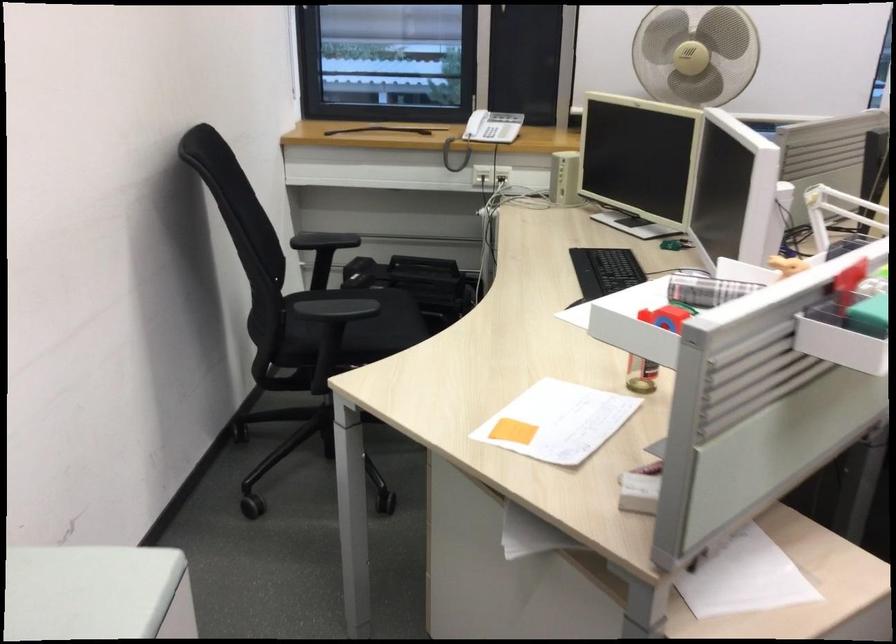
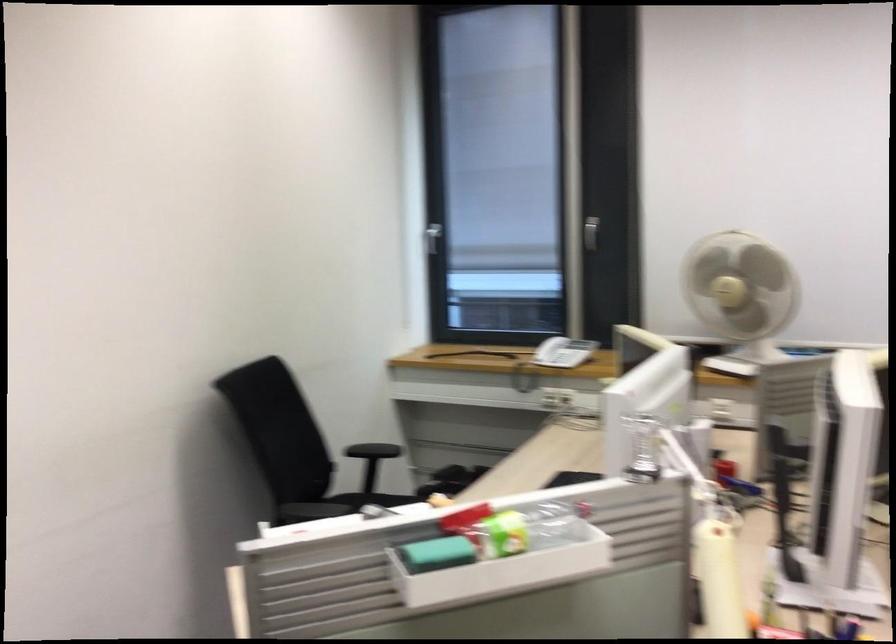
Find the pixel in the second image that matches point 669,281 in the first image.

(367, 509)